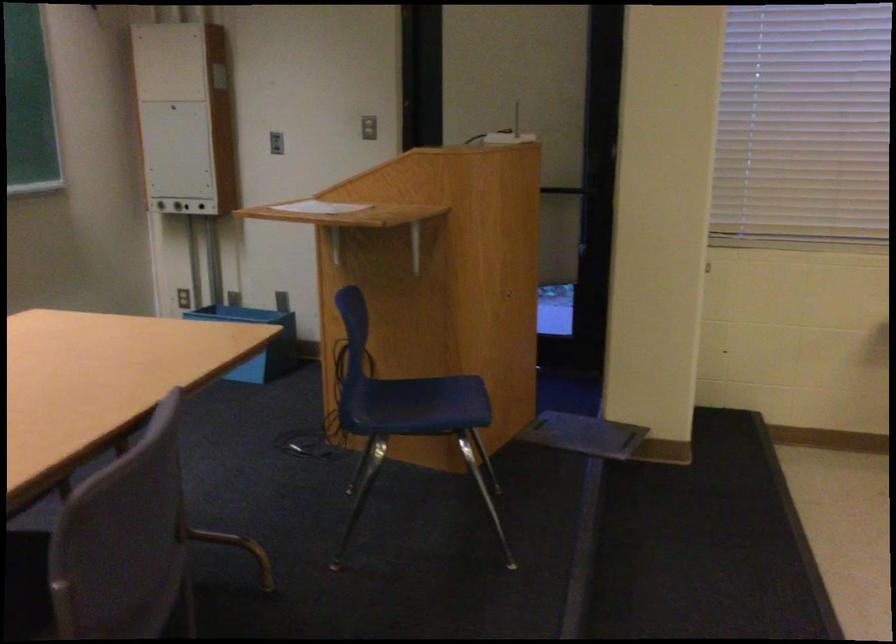
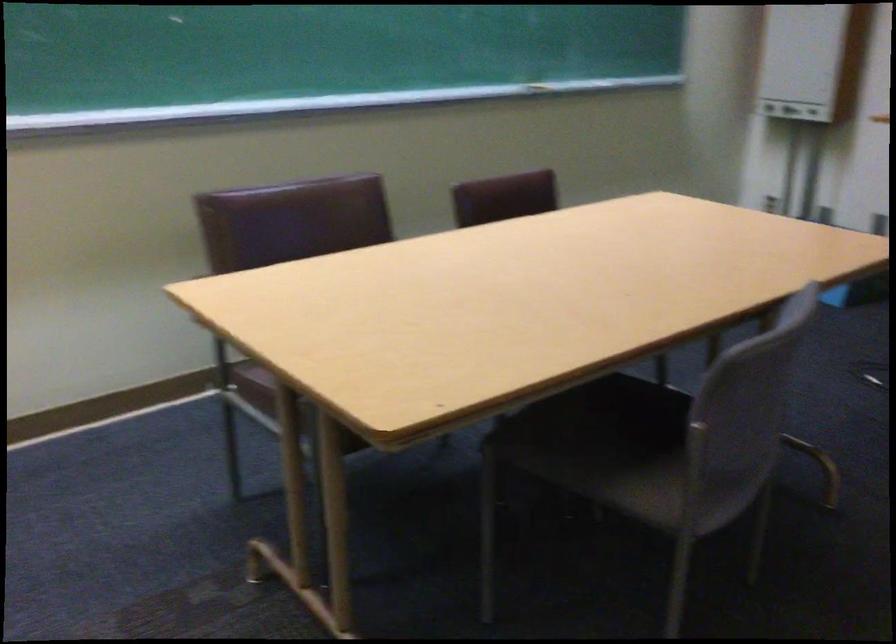
Question: Based on the continuous images, in which direction is the camera rotating? Reply with the corresponding letter.

Choices:
 (A) Left
 (B) Right
 (C) Up
 (D) Down

Answer: (A)